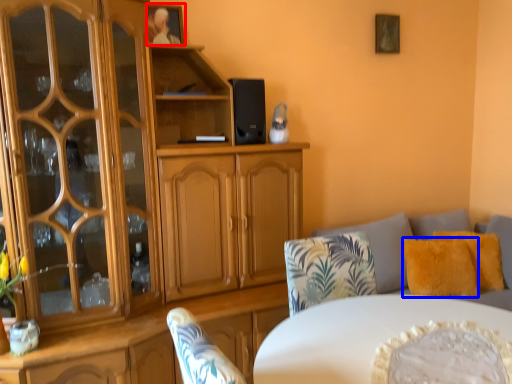
Question: Which of the following is the closest to the observer, picture frame (highlighted by a red box) or pillow (highlighted by a blue box)?

Choices:
 (A) picture frame
 (B) pillow

Answer: (A)